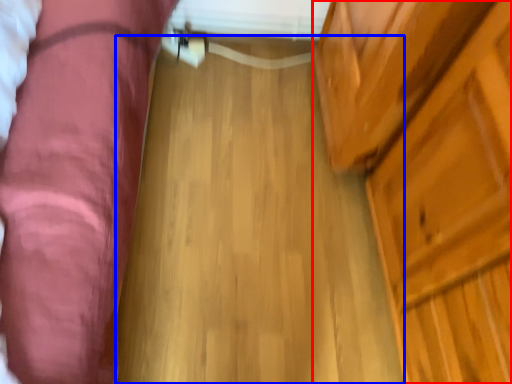
Question: Which point is closer to the camera, dresser (highlighted by a red box) or plank (highlighted by a blue box)?

Choices:
 (A) dresser
 (B) plank

Answer: (A)